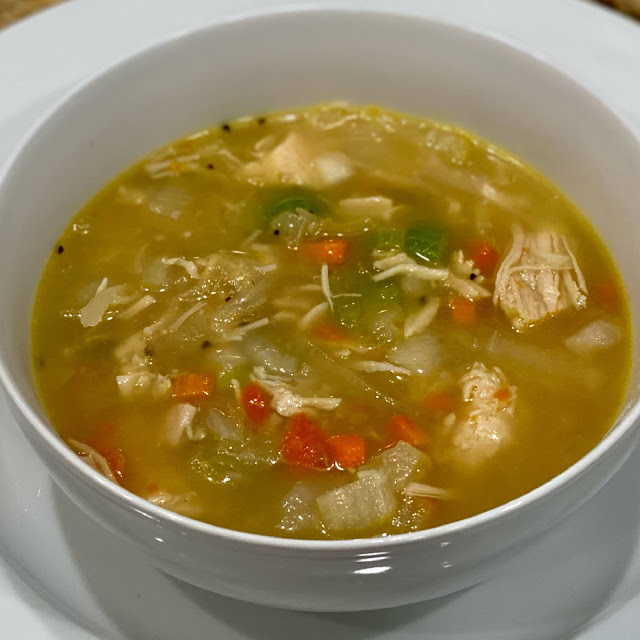
Where is `bowl`? bowl is located at coordinates (568, 45).